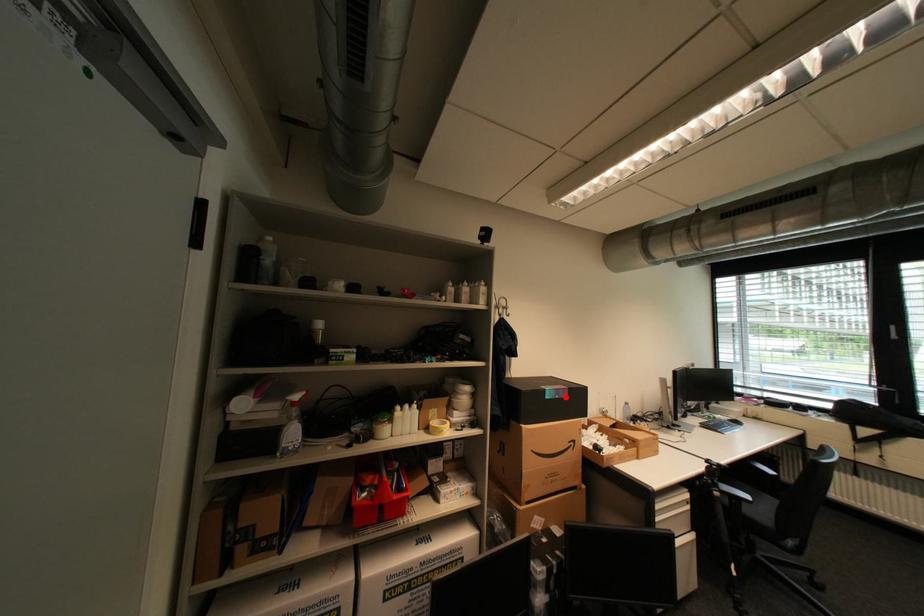
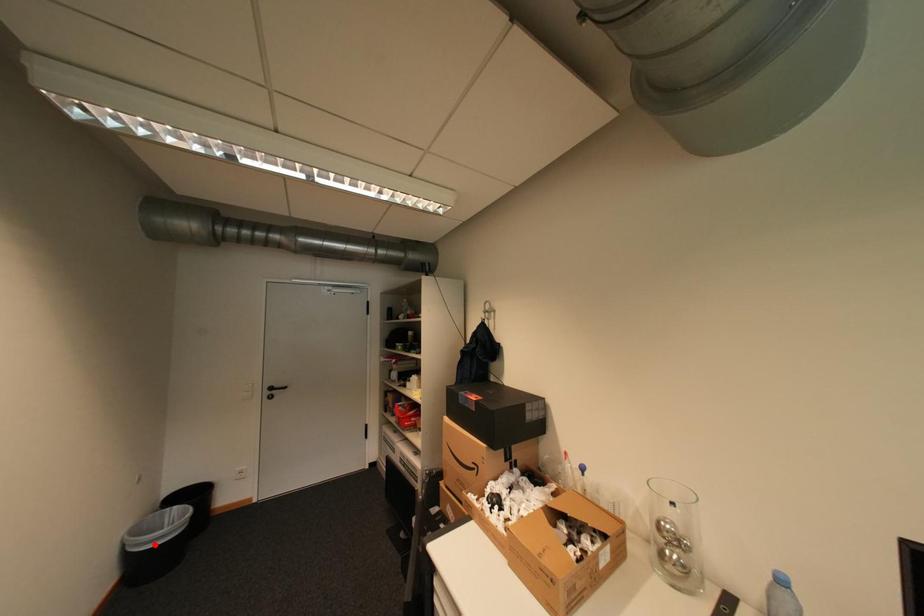
I am providing you with two images of the same scene from different viewpoints. A red point is marked on the first image and another point is marked on the second image. Is the red point in image1 aligned with the point shown in image2?

No